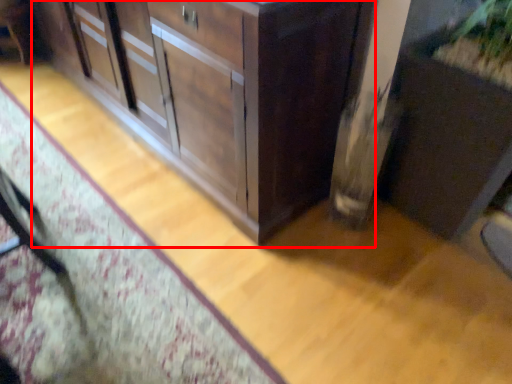
Question: Considering the relative positions of cabinetry (annotated by the red box) and cabinetry in the image provided, where is cabinetry (annotated by the red box) located with respect to the staircase?

Choices:
 (A) left
 (B) right

Answer: (A)